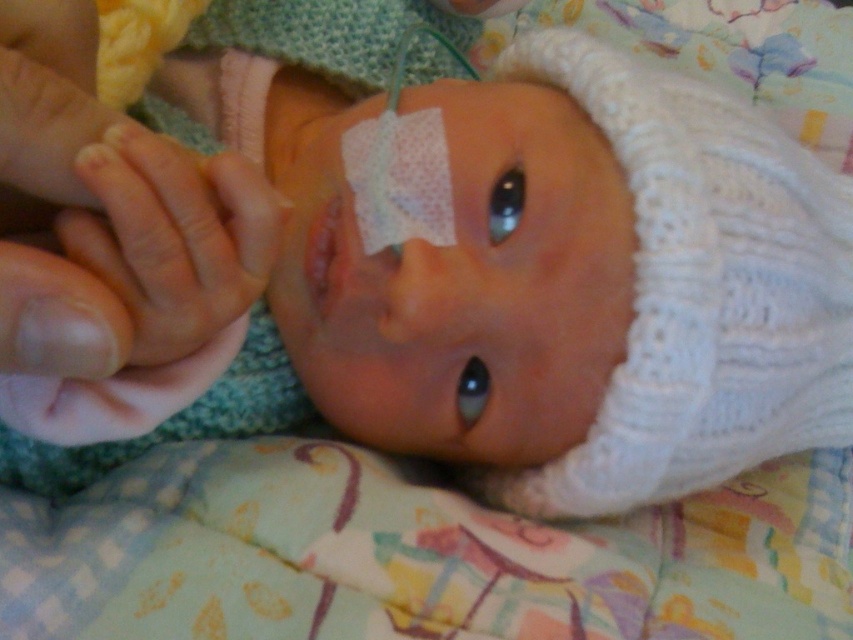
You are a nurse checking on a baby. You see the matte plastic eye patch at center and the pale skin hand at left. Which object is closer to you?

The matte plastic eye patch at center is closer to you than the pale skin hand at left.